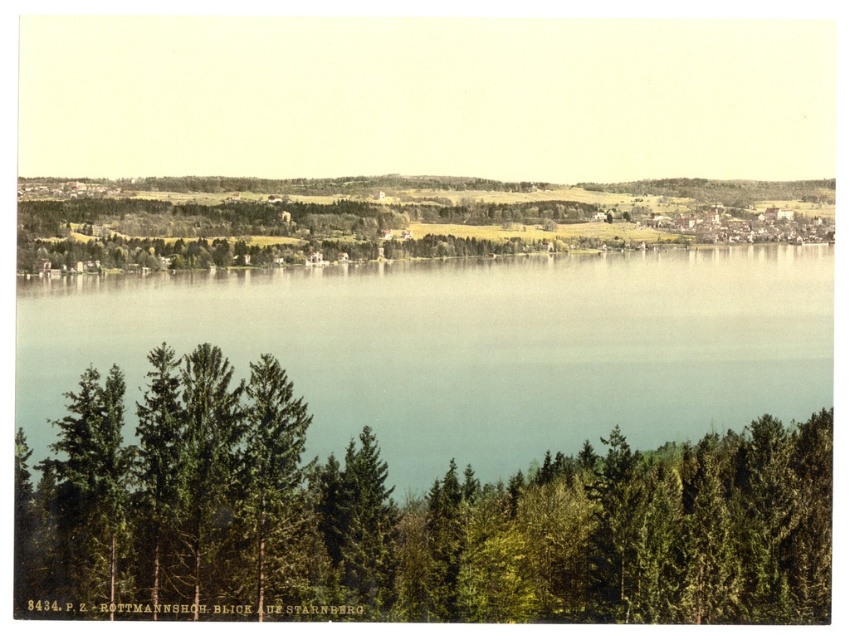
Measure the distance between point (233, 420) and camera.

They are 1132.25 feet apart.

Does green textured trees at lower center have a lesser height compared to clear blue water at center?

No, green textured trees at lower center is not shorter than clear blue water at center.

You are a GUI agent. You are given a task and a screenshot of the screen. Output one action in this format:
    pyautogui.click(x=<x>, y=<y>)
    Task: Click on the green textured trees at lower center
    
    Given the screenshot: What is the action you would take?
    pyautogui.click(x=404, y=518)

Locate an element on the screen. green textured trees at lower center is located at coordinates coord(404,518).